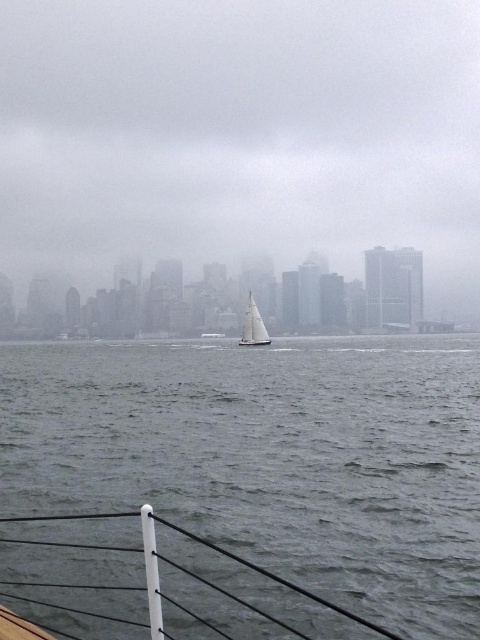
Can you confirm if white sailboat at center is positioned above white matte sailboat at center?

Indeed, white sailboat at center is positioned over white matte sailboat at center.

Which is more to the left, white sailboat at center or white matte sailboat at center?

white matte sailboat at center

Identify the location of white sailboat at center. (240, 134).

Does white matte boat at lower center appear over white matte sailboat at center?

Actually, white matte boat at lower center is below white matte sailboat at center.

Between white matte boat at lower center and white matte sailboat at center, which one has less height?

With less height is white matte boat at lower center.

Is point (55, 515) farther from camera compared to point (259, 324)?

No, (55, 515) is closer to viewer.

The height and width of the screenshot is (640, 480). Find the location of `white matte boat at lower center`. white matte boat at lower center is located at coordinates (273, 577).

Is white sailboat at center wider than white matte boat at lower center?

Yes.

Locate an element on the screen. The width and height of the screenshot is (480, 640). white sailboat at center is located at coordinates (240, 134).

Where is `white sailboat at center`? white sailboat at center is located at coordinates (240, 134).